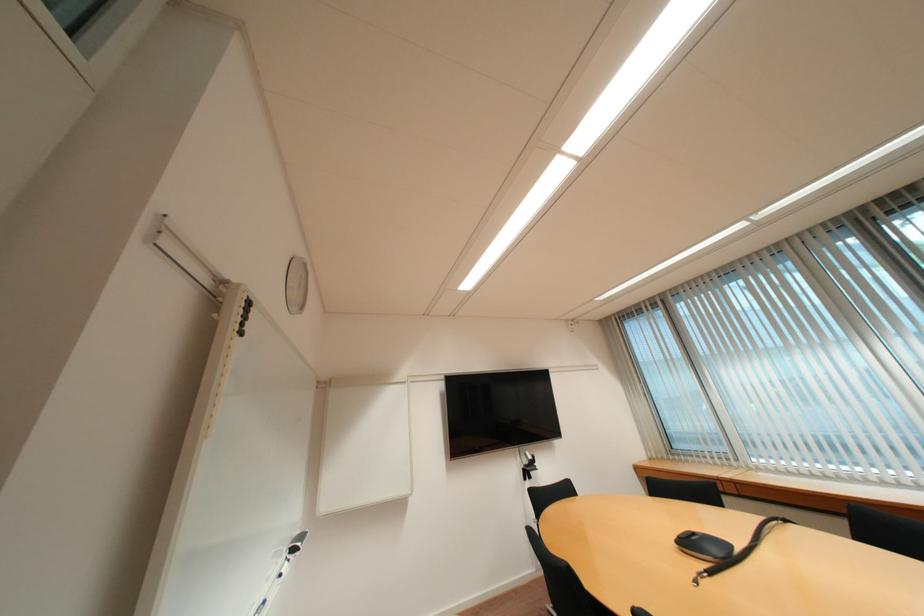
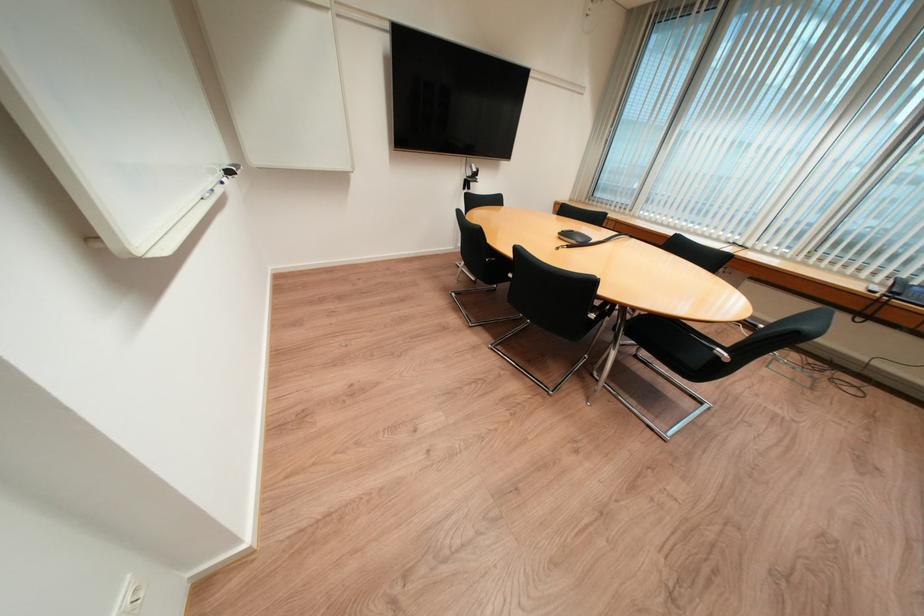
Where in the second image is the point corresponding to [697,544] from the first image?

(574, 236)